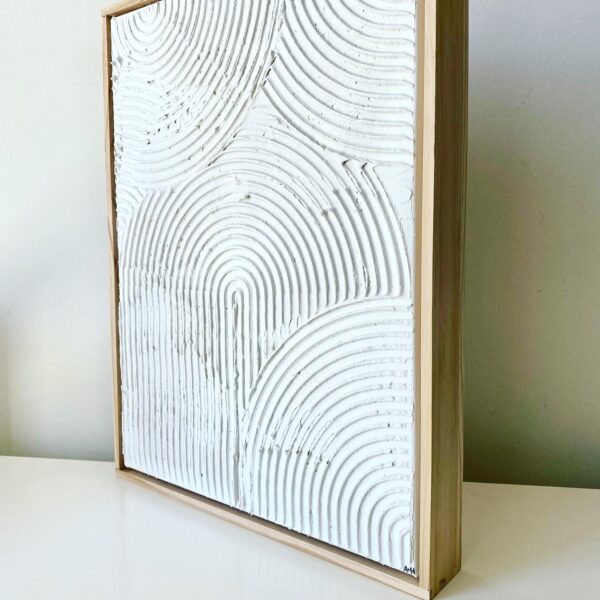
Locate an element on the screen. shaded part of wall is located at coordinates (549, 347), (546, 112).